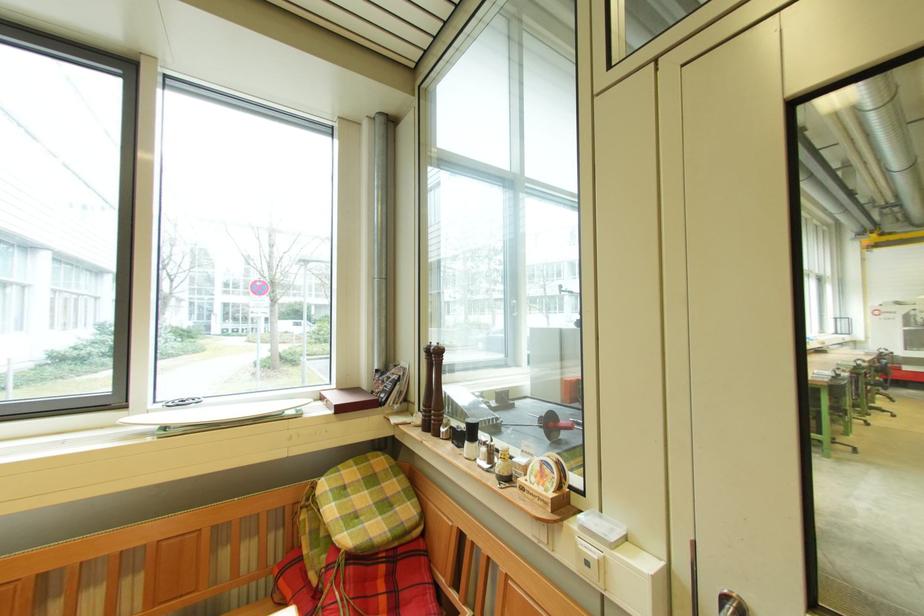
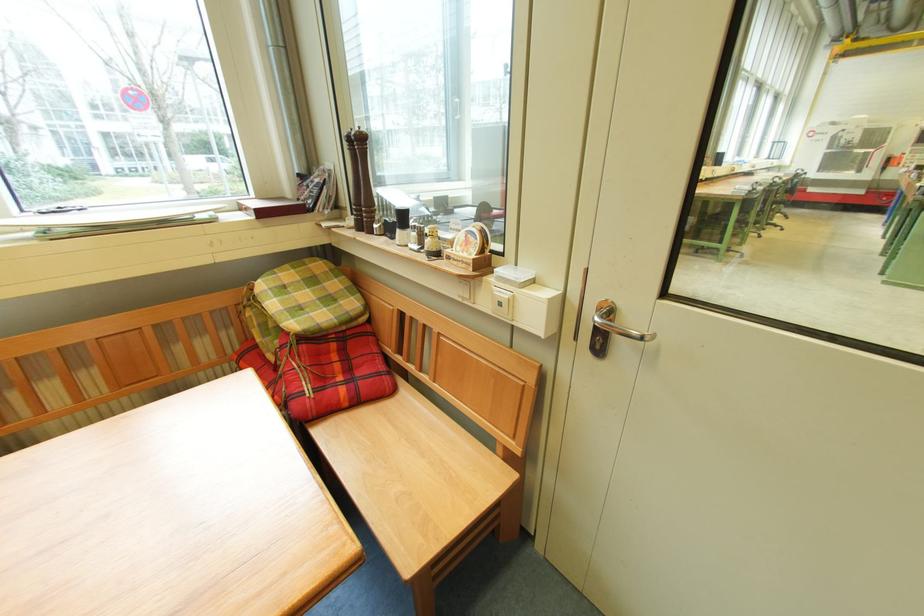
The point at (332, 560) is marked in the first image. Where is the corresponding point in the second image?

(285, 344)